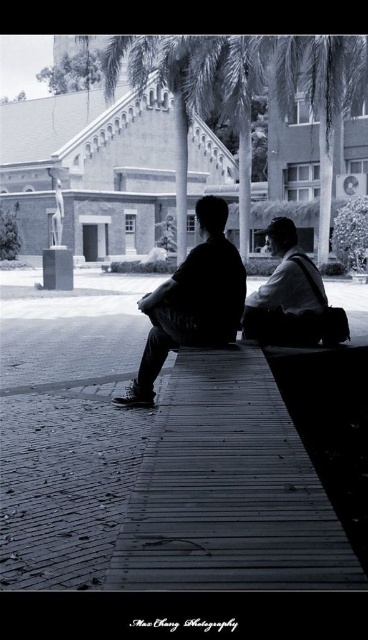
Which is behind, point (224, 296) or point (298, 324)?

Point (298, 324)

Who is positioned more to the right, black matte jacket at center or matte black jacket at center?

matte black jacket at center is more to the right.

At what (x,y) coordinates should I click in order to perform the action: click on black matte jacket at center. Please return your answer as a coordinate pair (x, y). Looking at the image, I should click on (192, 301).

Where is `black matte jacket at center`? This screenshot has width=368, height=640. black matte jacket at center is located at coordinates (192, 301).